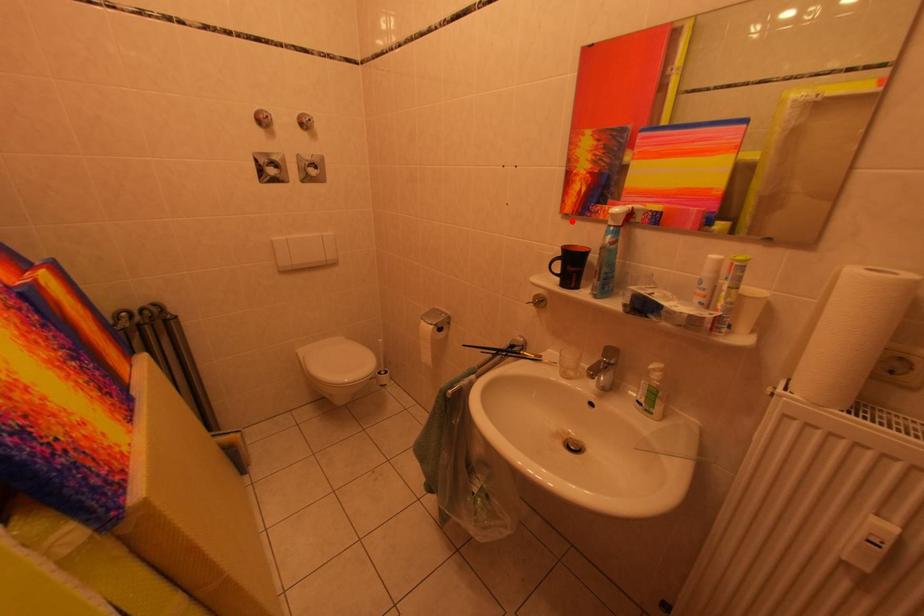
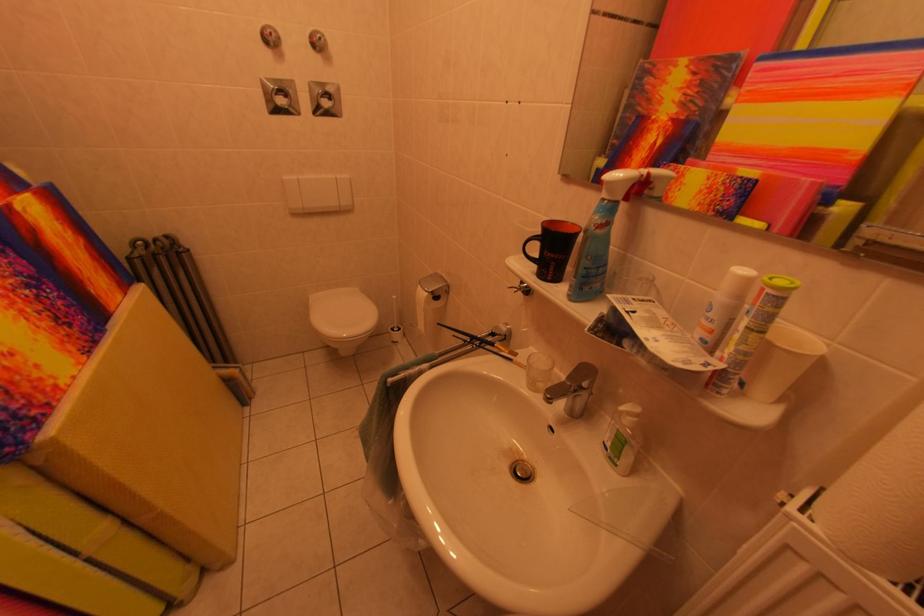
The point at the highlighted location is marked in the first image. Where is the corresponding point in the second image?

(569, 184)